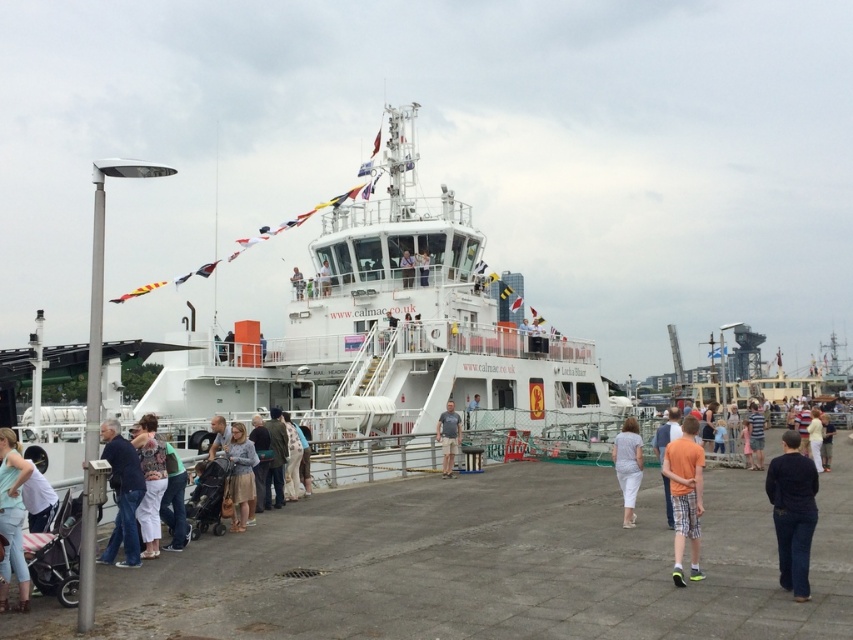
You are a photographer at the dock and want to capture the light gray fabric skirt at center and the light blue denim shorts at center in a single shot. Which clothing item will appear taller in the photo?

The light gray fabric skirt at center will appear taller in the photo because it has a greater height compared to the light blue denim shorts at center.